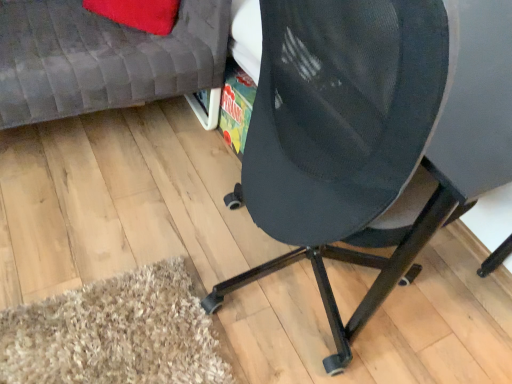
Identify the location of free space that is to the left of black mesh chair at center. (154, 238).